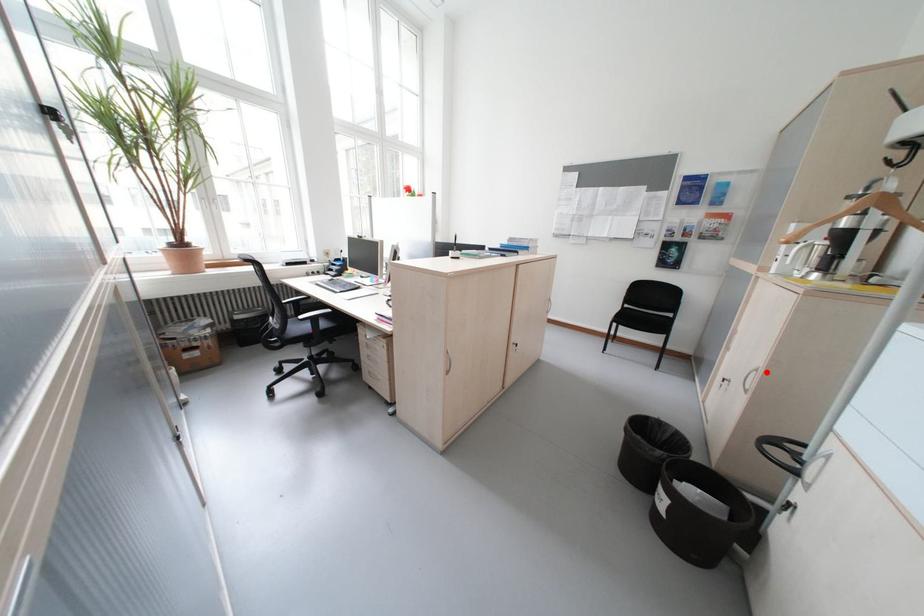
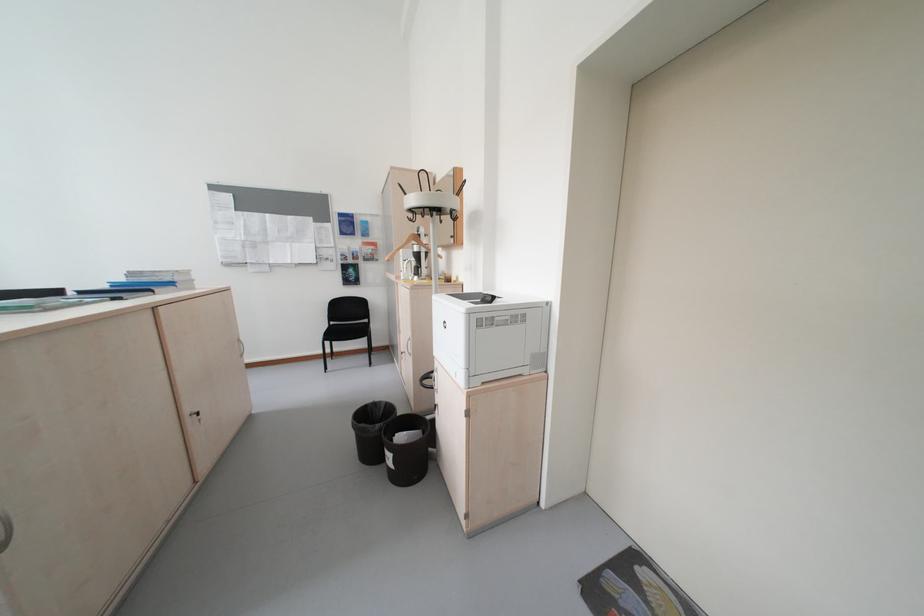
The point at the highlighted location is marked in the first image. Where is the corresponding point in the second image?

(419, 341)